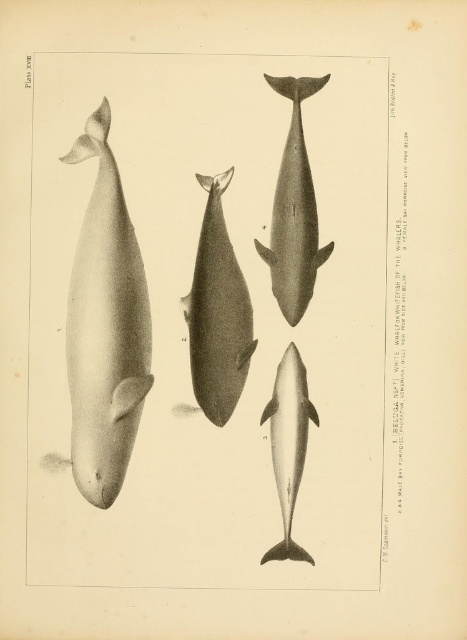
Is smooth gray whale at center thinner than smooth gray dolphin at center?

No.

Which is above, smooth gray whale at center or smooth gray dolphin at center?

smooth gray whale at center is above.

Who is more distant from viewer, (226, 378) or (285, 419)?

Point (226, 378)

At what (x,y) coordinates should I click in order to perform the action: click on smooth gray whale at center. Please return your answer as a coordinate pair (x, y). This screenshot has width=467, height=640. Looking at the image, I should click on (218, 312).

Who is shorter, smooth gray whale at upper center or smooth gray dolphin at center?

smooth gray dolphin at center is shorter.

Does point (287, 316) lie behind point (283, 369)?

That is False.

Locate an element on the screen. The height and width of the screenshot is (640, 467). smooth gray whale at upper center is located at coordinates (294, 211).

Does smooth gray whale at left appear on the right side of smooth gray whale at center?

In fact, smooth gray whale at left is to the left of smooth gray whale at center.

Between smooth gray whale at left and smooth gray whale at center, which one appears on the right side from the viewer's perspective?

smooth gray whale at center is more to the right.

At what (x,y) coordinates should I click in order to perform the action: click on smooth gray whale at left. Please return your answer as a coordinate pair (x, y). Looking at the image, I should click on (106, 326).

The image size is (467, 640). Find the location of `smooth gray whale at left`. smooth gray whale at left is located at coordinates (106, 326).